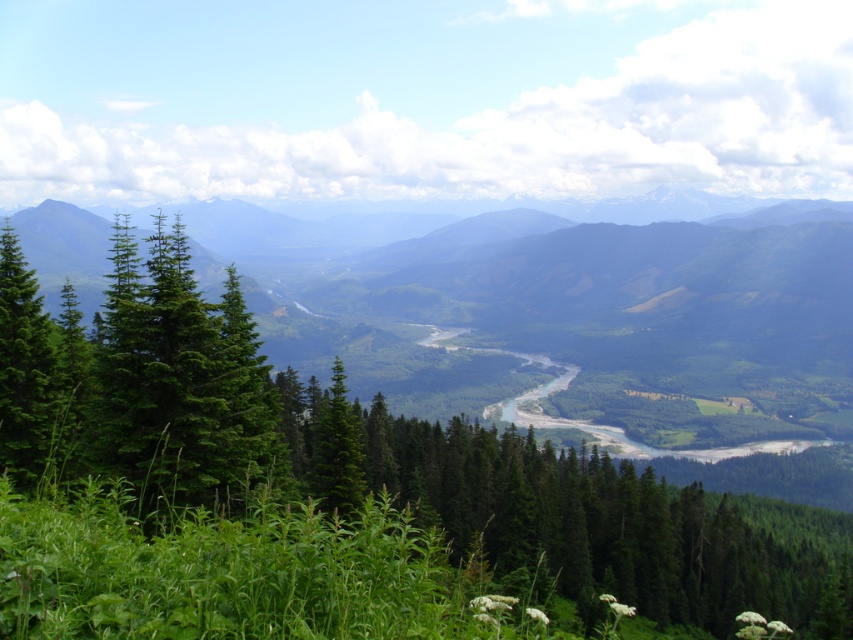
Locate an element on the screen. Image resolution: width=853 pixels, height=640 pixels. green evergreen tree at center is located at coordinates (389, 467).

Can you confirm if green evergreen tree at center is shorter than green matte tree at left?

In fact, green evergreen tree at center may be taller than green matte tree at left.

Image resolution: width=853 pixels, height=640 pixels. I want to click on green evergreen tree at center, so click(x=389, y=467).